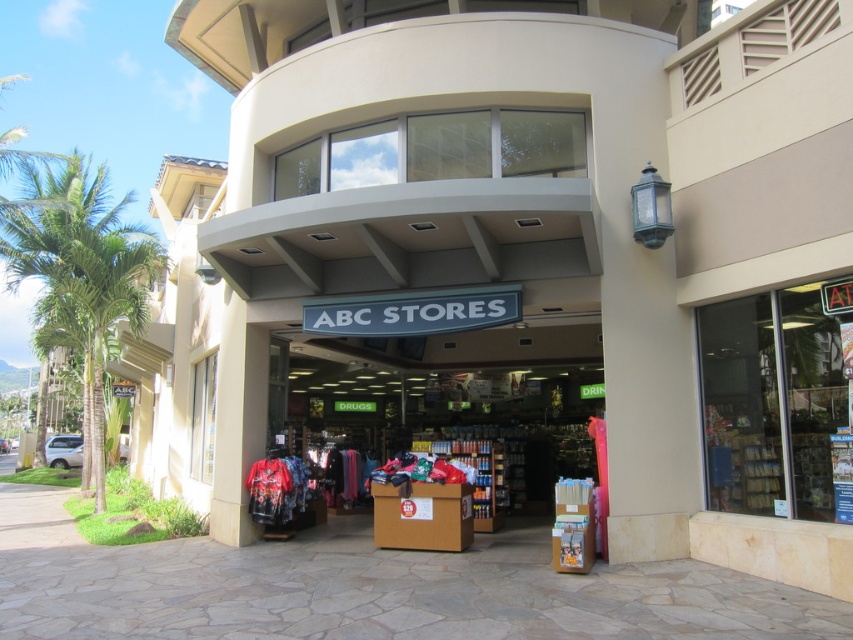
Question: Can you confirm if clear glass door at center is smaller than green leafy palm tree at left?

Choices:
 (A) yes
 (B) no

Answer: (A)

Question: Which of the following is the closest to the observer?

Choices:
 (A) clear glass door at center
 (B) green leafy palm tree at left

Answer: (A)

Question: Is clear glass door at center thinner than green leafy palm tree at left?

Choices:
 (A) yes
 (B) no

Answer: (A)

Question: From the image, what is the correct spatial relationship of clear glass door at center in relation to green leafy palm tree at left?

Choices:
 (A) above
 (B) below

Answer: (B)

Question: Which object is farther from the camera taking this photo?

Choices:
 (A) clear glass door at center
 (B) green leafy palm tree at left

Answer: (B)